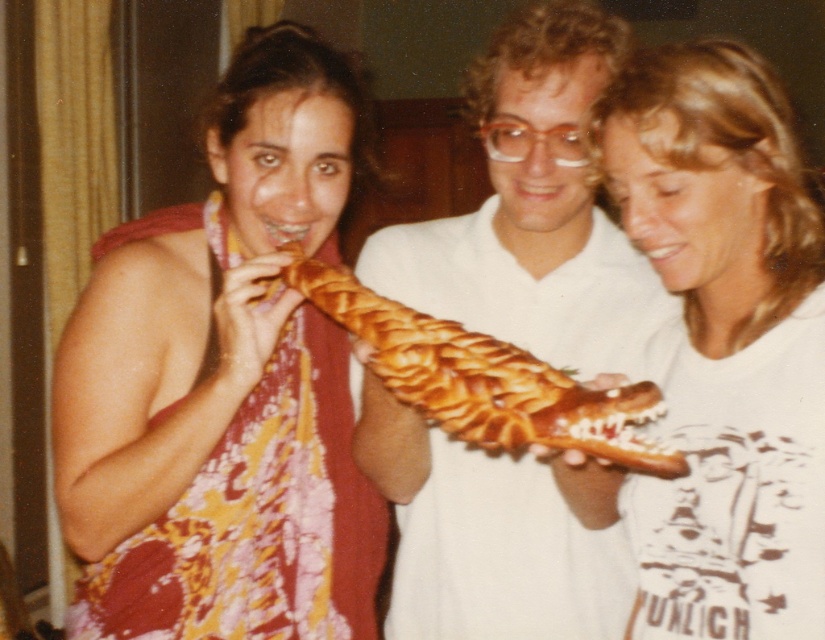
Does point (640, 124) come in front of point (564, 371)?

Yes, it is.

Does white matte t-shirt at center have a smaller size compared to golden braided bread at center?

Actually, white matte t-shirt at center might be larger than golden braided bread at center.

Locate an element on the screen. The image size is (825, 640). white matte t-shirt at center is located at coordinates (720, 348).

This screenshot has height=640, width=825. Describe the element at coordinates (720, 348) in the screenshot. I see `white matte t-shirt at center` at that location.

Is white matte t-shirt at center positioned behind matte white shirt at center?

No, white matte t-shirt at center is in front of matte white shirt at center.

I want to click on white matte t-shirt at center, so click(720, 348).

Does point (251, 216) lie behind point (290, 252)?

Yes.

Image resolution: width=825 pixels, height=640 pixels. Find the location of `matte yellow dress at center`. matte yellow dress at center is located at coordinates (224, 385).

What are the coordinates of `matte yellow dress at center` in the screenshot? It's located at (224, 385).